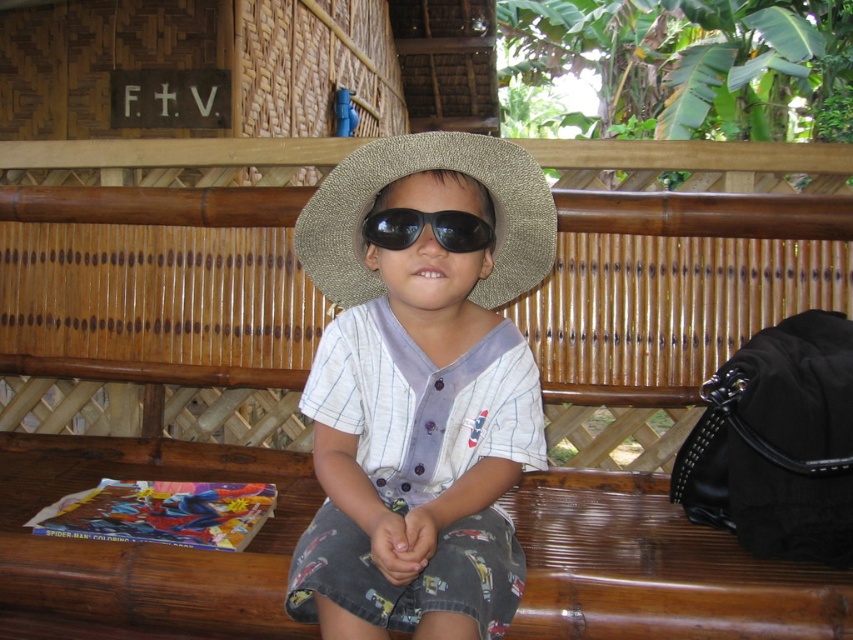
You are a photographer trying to capture the perfect shot of the child wearing the matte straw hat at center. To ensure the hat is in focus, you need to know its exact position. Based on the coordinates provided, can you determine if the hat is positioned centrally in the image?

The matte straw hat at center is located at point (x=421, y=390), which means it is slightly to the right of the exact center horizontally but centered vertically. Therefore, it is not perfectly centrally positioned in the image.

Looking at this image, you are a photographer trying to capture the child sitting on the wooden bench. You notice two hats on the child, a matte straw hat at center and a natural straw hat at center. Which hat is covering the other?

The matte straw hat at center is positioned under natural straw hat at center, so the natural straw hat at center is covering the matte straw hat at center.

From the picture: You are a photographer trying to capture the child in the image. You want to ensure both the natural straw hat at center and the black matte sunglasses at center are clearly visible in the photo. Given that your camera has a depth of field that can focus on objects within a 4 inch range, will both items be in focus?

The natural straw hat at center is 4.58 inches from the black matte sunglasses at center. Since the distance between them exceeds the 4 inch range of the camera, they might not both be in focus simultaneously.